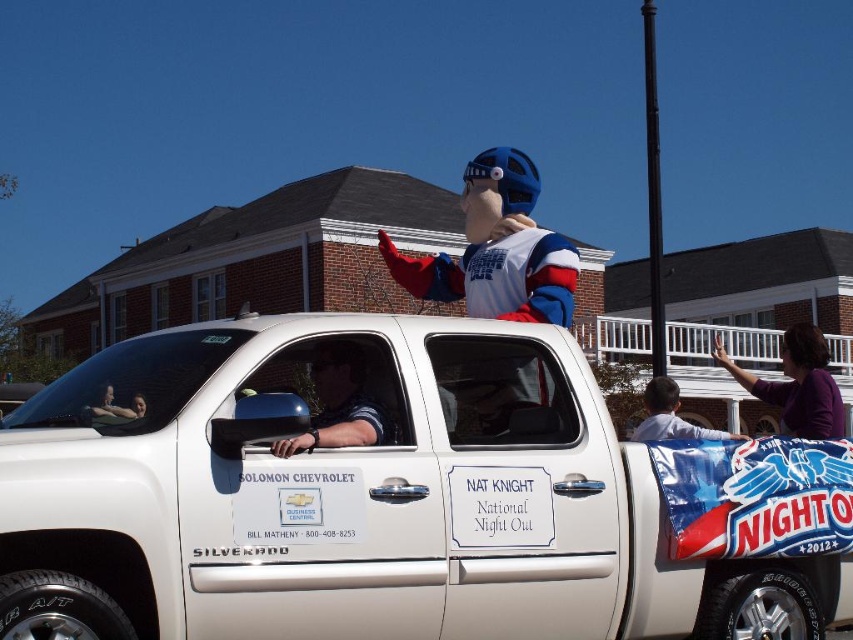
Does white matte truck at center lie behind purple fabric at upper right?

No, white matte truck at center is closer to the viewer.

Is white matte truck at center thinner than purple fabric at upper right?

Yes, white matte truck at center is thinner than purple fabric at upper right.

This screenshot has height=640, width=853. What do you see at coordinates (381, 497) in the screenshot? I see `white matte truck at center` at bounding box center [381, 497].

I want to click on white matte truck at center, so click(381, 497).

Is the position of purple fabric at upper right more distant than that of light blue shirt at center?

That is True.

Is point (834, 403) closer to camera compared to point (660, 408)?

Yes.

Between point (820, 358) and point (648, 410), which one is positioned behind?

The point (648, 410) is behind.

I want to click on purple fabric at upper right, so click(x=798, y=385).

Is polished dark blue shirt at center positioned at the back of purple fabric at upper right?

No, polished dark blue shirt at center is closer to the viewer.

Which is more to the right, polished dark blue shirt at center or purple fabric at upper right?

purple fabric at upper right is more to the right.

Describe the element at coordinates (340, 403) in the screenshot. I see `polished dark blue shirt at center` at that location.

Locate an element on the screen. This screenshot has width=853, height=640. polished dark blue shirt at center is located at coordinates (340, 403).